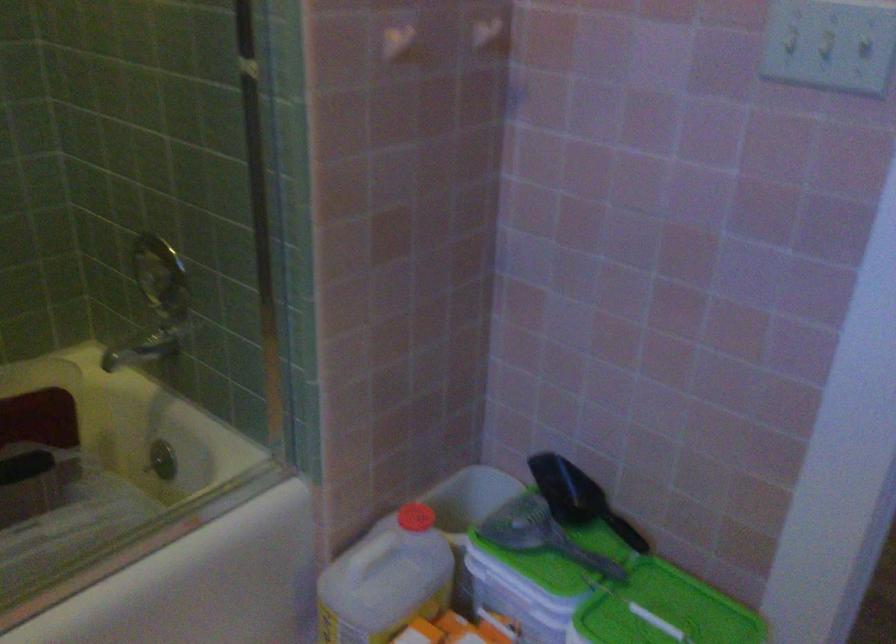
The height and width of the screenshot is (644, 896). Find the location of `red bottle cap`. red bottle cap is located at coordinates (416, 516).